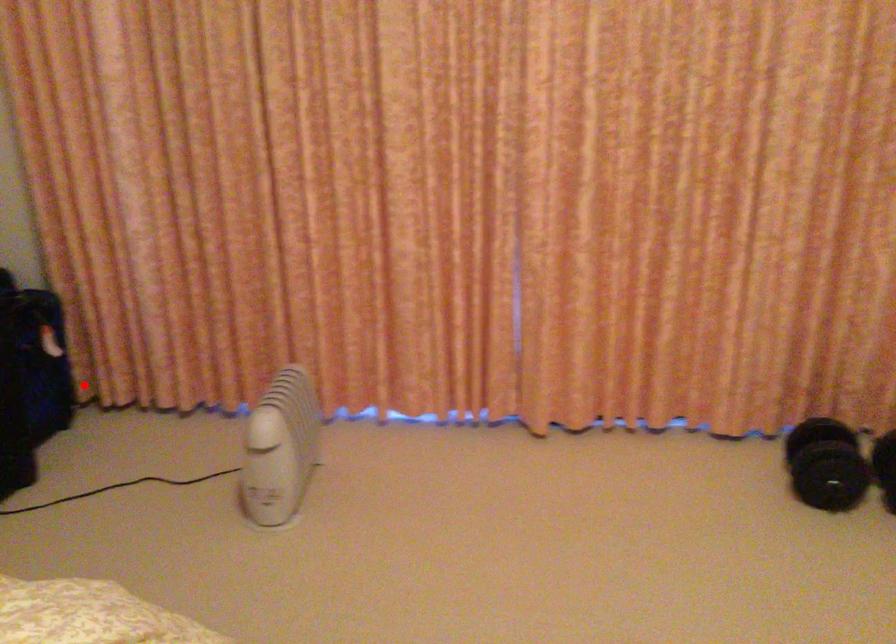
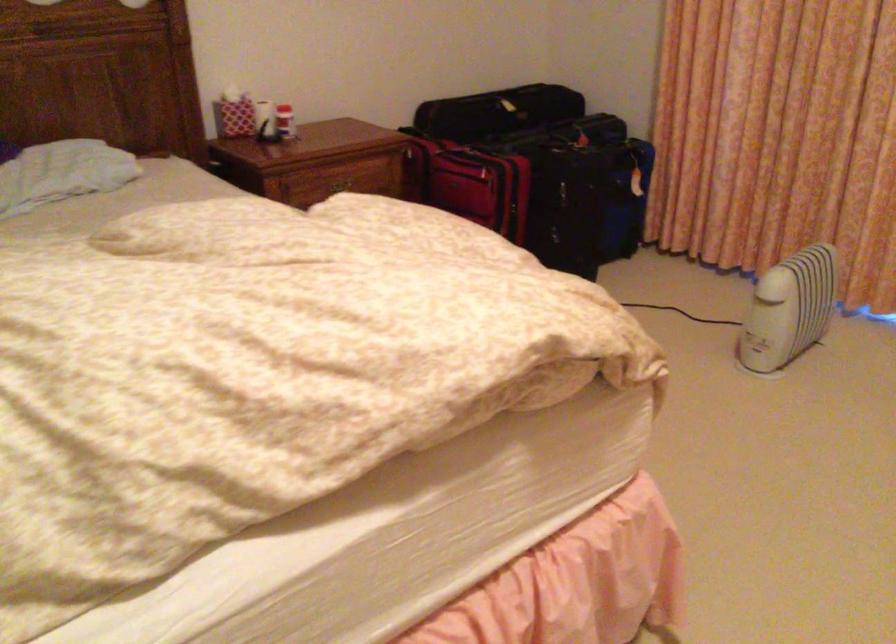
Question: I am providing you with two images of the same scene from different viewpoints. Given a red point in image1, look at the same physical point in image2. Is it:

Choices:
 (A) Closer to the viewpoint
 (B) Farther from the viewpoint

Answer: (B)